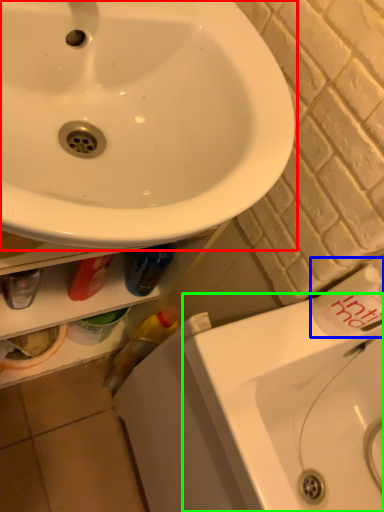
Question: Which object is the farthest from sink (highlighted by a red box)? Choose among these: toiletry (highlighted by a blue box) or counter top (highlighted by a green box).

Choices:
 (A) toiletry
 (B) counter top

Answer: (B)